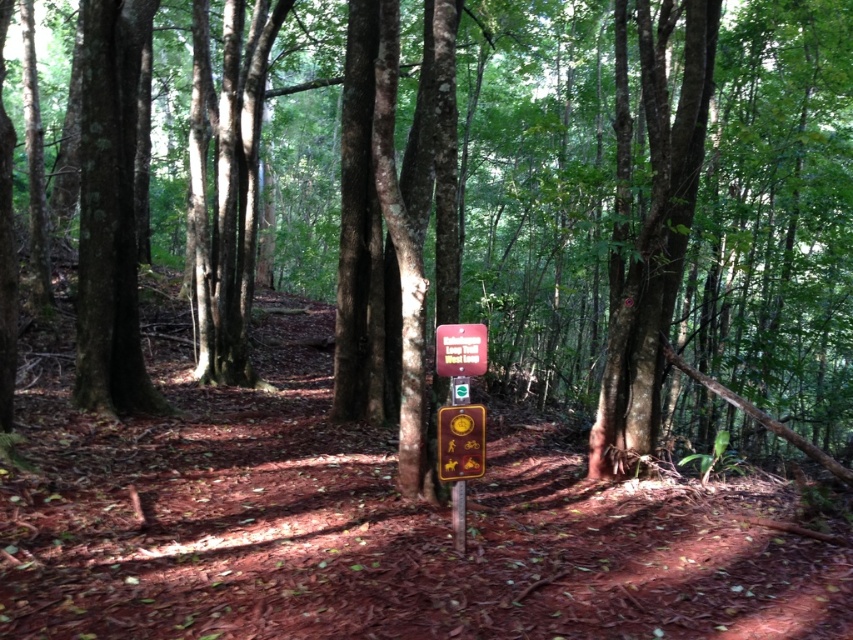
Question: Does metallic gold sign at center have a smaller size compared to wooden sign at center?

Choices:
 (A) no
 (B) yes

Answer: (B)

Question: Does metallic gold sign at center have a greater width compared to wooden sign at center?

Choices:
 (A) no
 (B) yes

Answer: (A)

Question: Is metallic gold sign at center positioned before wooden sign at center?

Choices:
 (A) yes
 (B) no

Answer: (B)

Question: Which object appears closest to the camera in this image?

Choices:
 (A) wooden sign at center
 (B) metallic gold sign at center

Answer: (A)